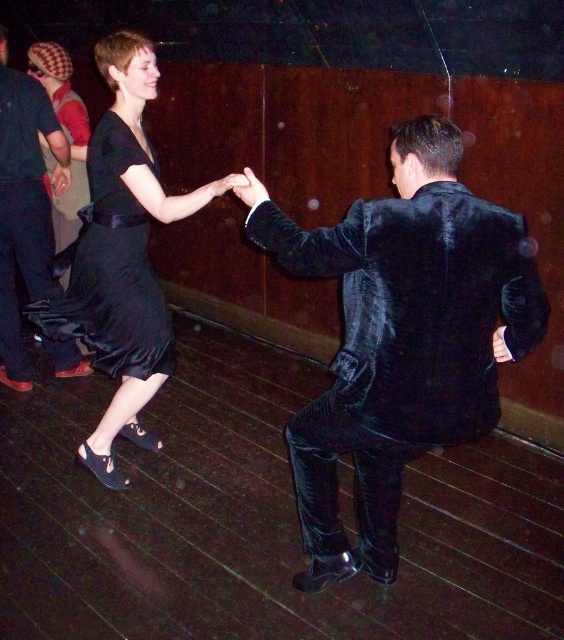
Question: Is velvet black suit at right smaller than satin black dress at center?

Choices:
 (A) no
 (B) yes

Answer: (A)

Question: Which of the following is the farthest from the observer?

Choices:
 (A) velvet black suit at upper left
 (B) velvet black suit at right
 (C) satin black dress at center

Answer: (A)

Question: Which point appears closest to the camera in this image?

Choices:
 (A) (94, 177)
 (B) (424, 248)
 (C) (113, 353)
 (D) (81, 365)

Answer: (B)

Question: Which of the following is the farthest from the observer?

Choices:
 (A) satin black dress at center
 (B) velvet black suit at right
 (C) velvet black suit at upper left

Answer: (C)

Question: Does velvet black suit at right lie behind black satin dress at upper left?

Choices:
 (A) yes
 (B) no

Answer: (B)

Question: Is velvet black suit at right further to the viewer compared to satin black dress at center?

Choices:
 (A) no
 (B) yes

Answer: (A)